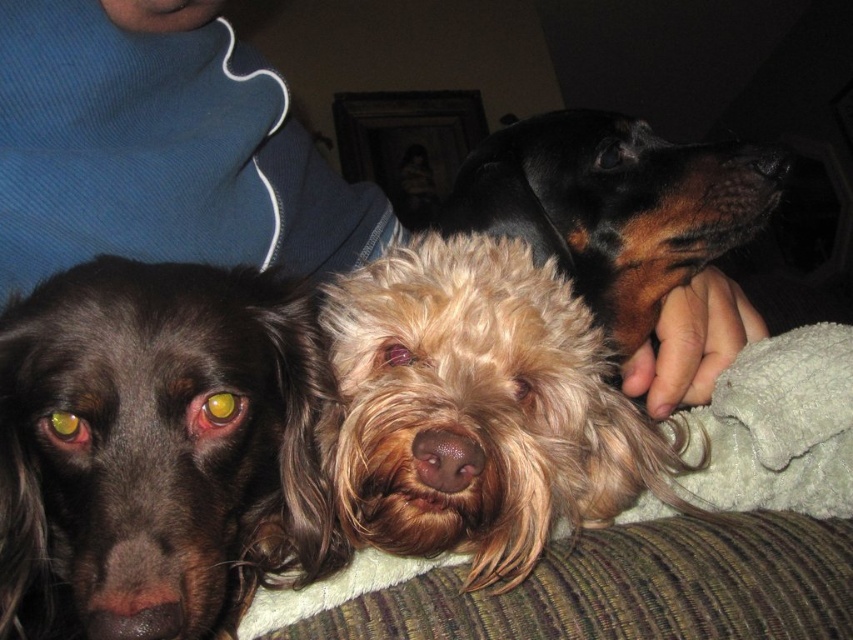
Question: Is the position of brown shaggy dog at center more distant than that of fuzzy brown dog at center?

Choices:
 (A) no
 (B) yes

Answer: (A)

Question: Which point appears closest to the camera in this image?

Choices:
 (A) click(x=169, y=472)
 (B) click(x=555, y=488)

Answer: (A)

Question: Does brown shaggy dog at center lie in front of fuzzy brown dog at center?

Choices:
 (A) yes
 (B) no

Answer: (A)

Question: Which point is farther to the camera?

Choices:
 (A) (189, 547)
 (B) (431, 481)

Answer: (B)

Question: Is brown shaggy dog at center above fuzzy brown dog at center?

Choices:
 (A) yes
 (B) no

Answer: (B)